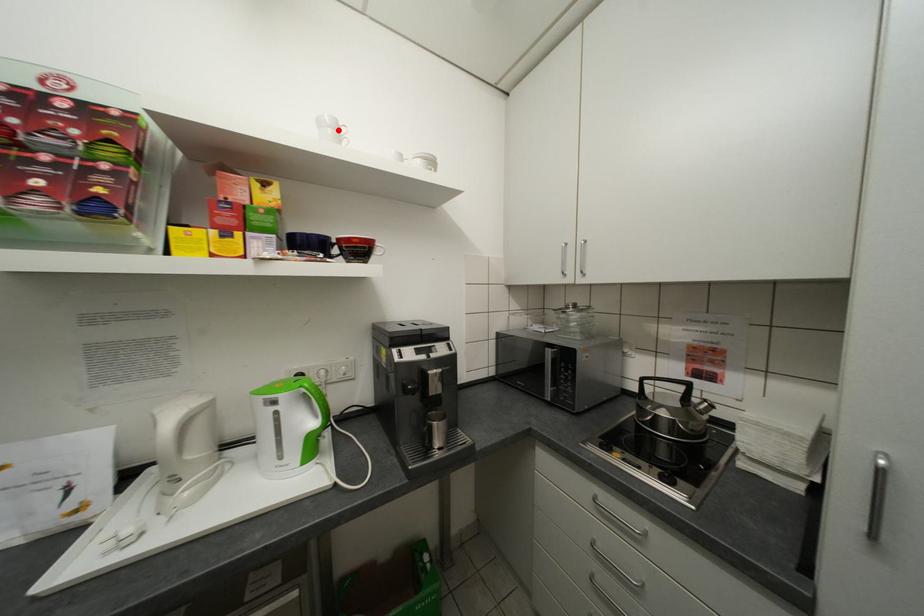
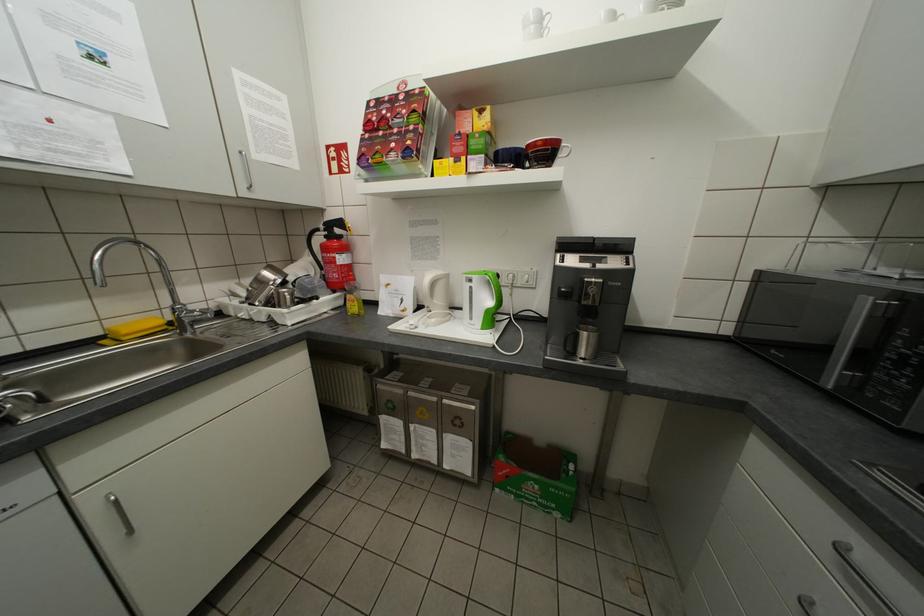
Find the pixel in the second image that matches the highlighted location in the first image.

(541, 28)